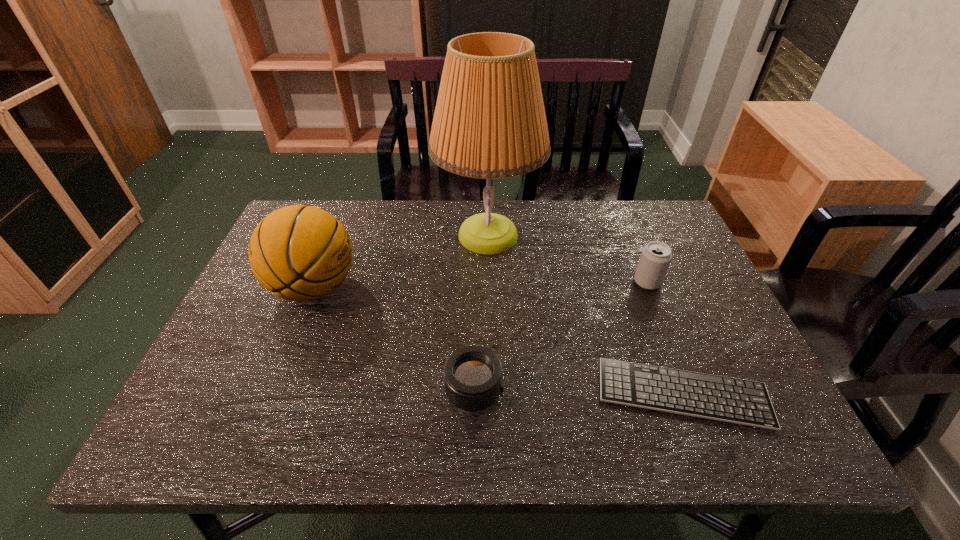
Identify the location of vacant area that lies between the shortest object and the third tallest object. (665, 338).

Image resolution: width=960 pixels, height=540 pixels. I want to click on vacant space in between the computer keyboard and the third tallest object, so click(665, 338).

What are the coordinates of `unoccupied area between the computer keyboard and the can` in the screenshot? It's located at (665, 338).

At what (x,y) coordinates should I click in order to perform the action: click on vacant area between the shortest object and the telephoto lens. Please return your answer as a coordinate pair (x, y). The height and width of the screenshot is (540, 960). Looking at the image, I should click on (579, 392).

Locate an element on the screen. Image resolution: width=960 pixels, height=540 pixels. empty space between the shortest object and the can is located at coordinates (665, 338).

You are a GUI agent. You are given a task and a screenshot of the screen. Output one action in this format:
    pyautogui.click(x=<x>, y=<y>)
    Task: Click on the vacant space in between the third tallest object and the computer keyboard
    Image resolution: width=960 pixels, height=540 pixels.
    Given the screenshot: What is the action you would take?
    pyautogui.click(x=665, y=338)

In order to click on free point between the shortest object and the telephoto lens in this screenshot , I will do pyautogui.click(x=579, y=392).

Find the location of a particular element. This screenshot has height=540, width=960. object that is the second closest to the can is located at coordinates (489, 122).

You are a GUI agent. You are given a task and a screenshot of the screen. Output one action in this format:
    pyautogui.click(x=<x>, y=<y>)
    Task: Click on the second closest object to the third shortest object
    This screenshot has width=960, height=540.
    Given the screenshot: What is the action you would take?
    pyautogui.click(x=489, y=122)

The height and width of the screenshot is (540, 960). What are the coordinates of `free space that satisfies the following two spatial constraints: 1. on the side of the fourth tallest object with brand markings and control switches; 2. on the left side of the shortest object` in the screenshot? It's located at (474, 393).